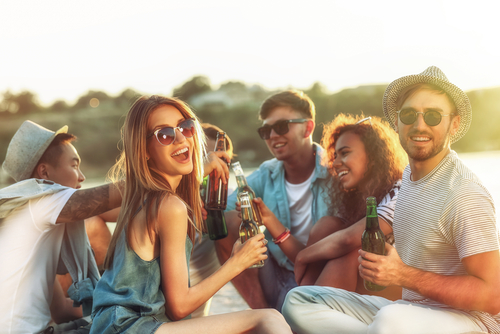
Image resolution: width=500 pixels, height=334 pixels. Identify the location of bottles. (374, 240), (247, 222), (239, 176), (217, 189), (213, 221).